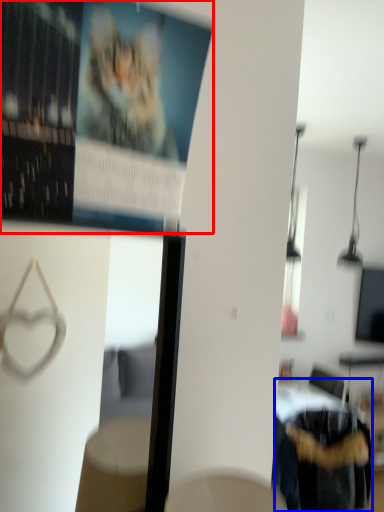
Question: Which of the following is the farthest to the observer, poster page (highlighted by a red box) or furniture (highlighted by a blue box)?

Choices:
 (A) poster page
 (B) furniture

Answer: (B)